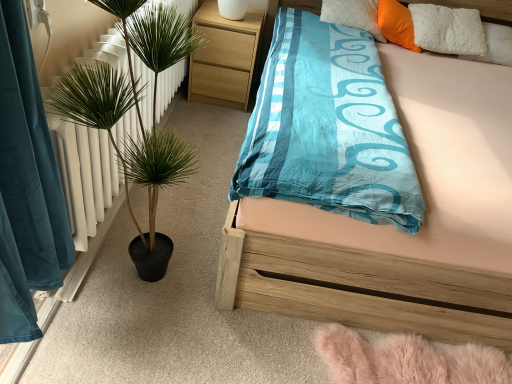
Locate an element on the screen. The width and height of the screenshot is (512, 384). vacant space in front of light wood/texture nightstand at upper center is located at coordinates (213, 122).